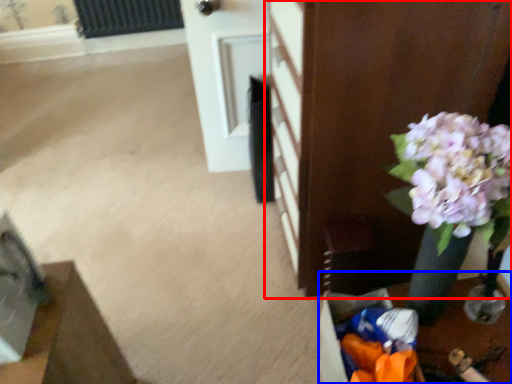
Question: Which object is closer to the camera taking this photo, furniture (highlighted by a red box) or table (highlighted by a blue box)?

Choices:
 (A) furniture
 (B) table

Answer: (A)